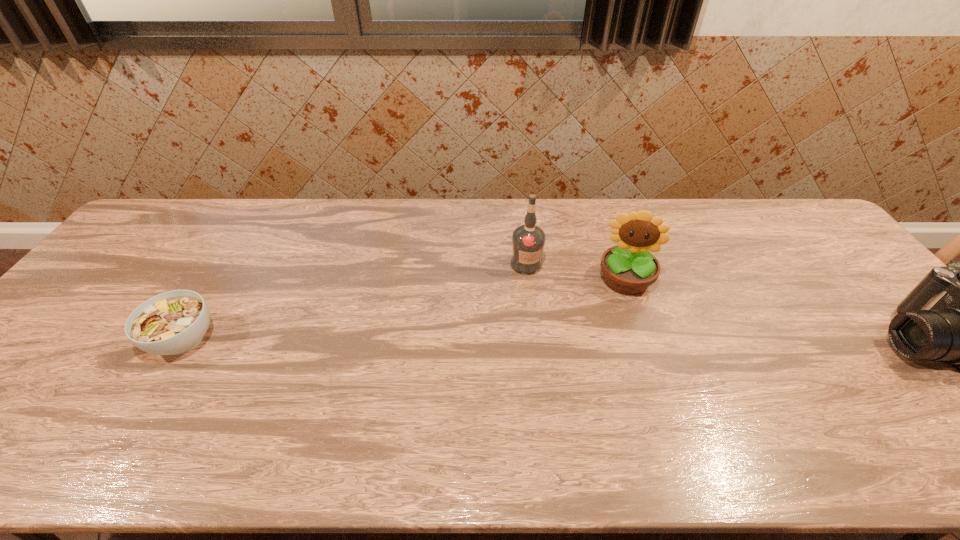
Locate an element on the screen. free space located 0.230m on the face of the sunflower is located at coordinates (619, 366).

This screenshot has height=540, width=960. What are the coordinates of `blank area at the far edge` in the screenshot? It's located at (500, 212).

Where is `vacant space at the near edge of the desktop`? The width and height of the screenshot is (960, 540). vacant space at the near edge of the desktop is located at coordinates (217, 401).

Where is `vacant space at the left edge of the desktop`? This screenshot has height=540, width=960. vacant space at the left edge of the desktop is located at coordinates (126, 306).

Image resolution: width=960 pixels, height=540 pixels. What are the coordinates of `vacant space at the right edge of the desktop` in the screenshot? It's located at (880, 332).

Where is `free region at the near left corner`? The height and width of the screenshot is (540, 960). free region at the near left corner is located at coordinates (45, 406).

Image resolution: width=960 pixels, height=540 pixels. In order to click on vacant area at the far right corner of the desktop in this screenshot , I will do coord(778,205).

Find the location of a particular element. vacant space that is in between the soup bowl and the third object from right to left is located at coordinates pyautogui.click(x=355, y=302).

In order to click on vacant space that's between the second object from right to left and the leftmost object in this screenshot , I will do `click(404, 310)`.

This screenshot has width=960, height=540. In order to click on vacant area that lies between the vodka and the soup bowl in this screenshot , I will do `click(355, 302)`.